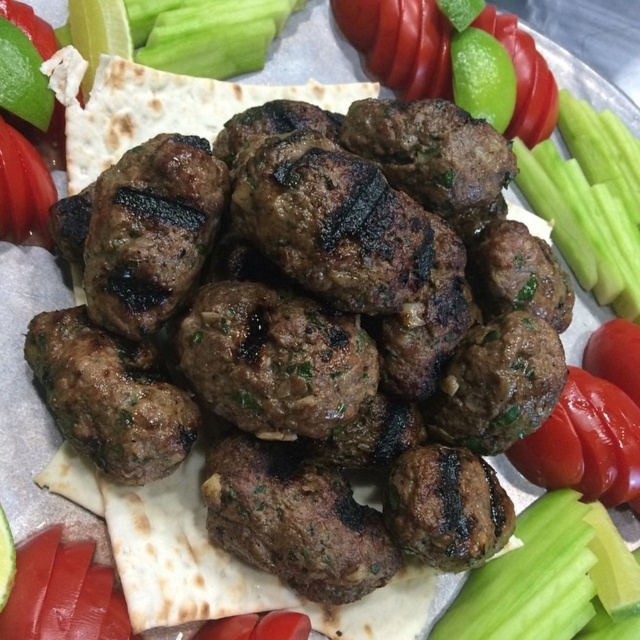
You are a food critic evaluating the presentation of this dish. Based on the arrangement of the brown grilled meatballs at center and the red matte tomato at lower right, which item is positioned closer to the left side of the plate?

The brown grilled meatballs at center are positioned to the left of the red matte tomato at lower right, so they are closer to the left side of the plate.

You are a food critic evaluating the arrangement of this dish. Which object is higher in height between the brown grilled meatballs at center and the green crisp celery at center?

The brown grilled meatballs at center are taller than the green crisp celery at center.

You have a small container that can only hold vegetables that are narrower than 3 inches. You need to store the green crisp celery at center and the red matte tomato at lower right. Based on their widths, which vegetable should you choose to fit into the container?

The green crisp celery at center might be wider than the red matte tomato at lower right, so the red matte tomato at lower right is more likely to fit into the container if it is narrower than 3 inches.